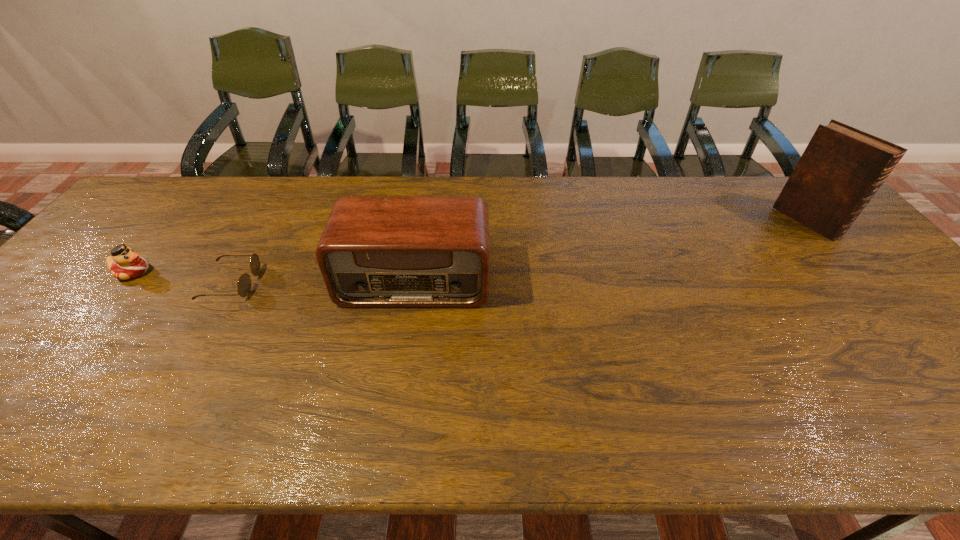
Locate an element on the screen. free space that satisfies the following two spatial constraints: 1. on the front panel of the second object from right to left; 2. on the lenses of the second object from left to right is located at coordinates (415, 283).

Locate an element on the screen. This screenshot has height=540, width=960. free space that satisfies the following two spatial constraints: 1. on the front panel of the second object from right to left; 2. on the lenses of the shortest object is located at coordinates (415, 283).